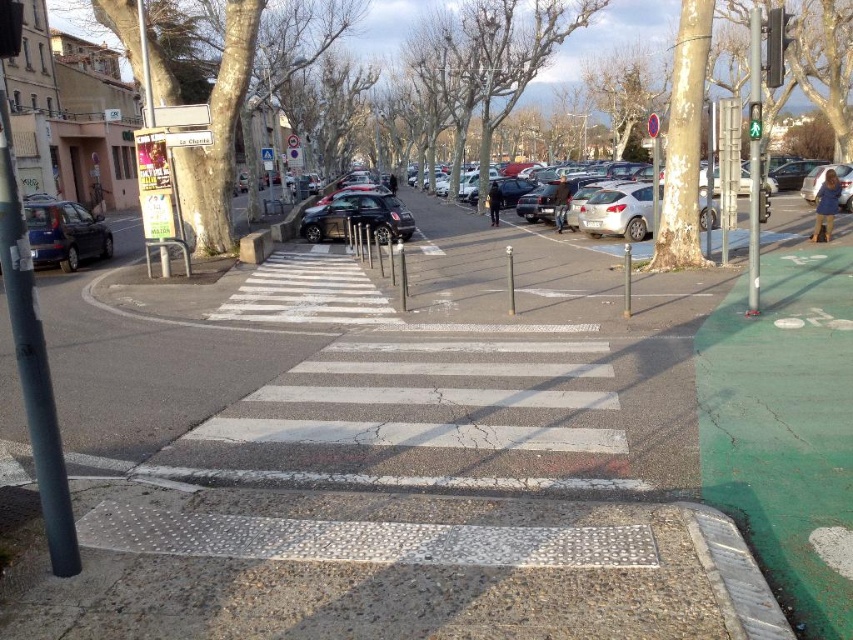
Question: Which object is closer to the camera taking this photo?

Choices:
 (A) metallic rectangular traffic light at upper right
 (B) silver metallic sedan at center
 (C) matte black car at left
 (D) green glass pedestrian signal at upper center

Answer: (C)

Question: Which point is farther to the camera?

Choices:
 (A) (801, 205)
 (B) (57, 262)
 (C) (775, 44)
 (D) (755, 131)

Answer: (A)

Question: Can you confirm if matte black car at left is bigger than green glass pedestrian signal at upper center?

Choices:
 (A) no
 (B) yes

Answer: (B)

Question: Can you confirm if silver metallic sedan at center is positioned to the right of metallic rectangular traffic light at upper right?

Choices:
 (A) yes
 (B) no

Answer: (A)

Question: Which point appears farthest from the camera in this image?

Choices:
 (A) (758, 102)
 (B) (776, 52)

Answer: (A)

Question: Does matte black car at left have a lesser width compared to green glass pedestrian signal at upper center?

Choices:
 (A) no
 (B) yes

Answer: (A)